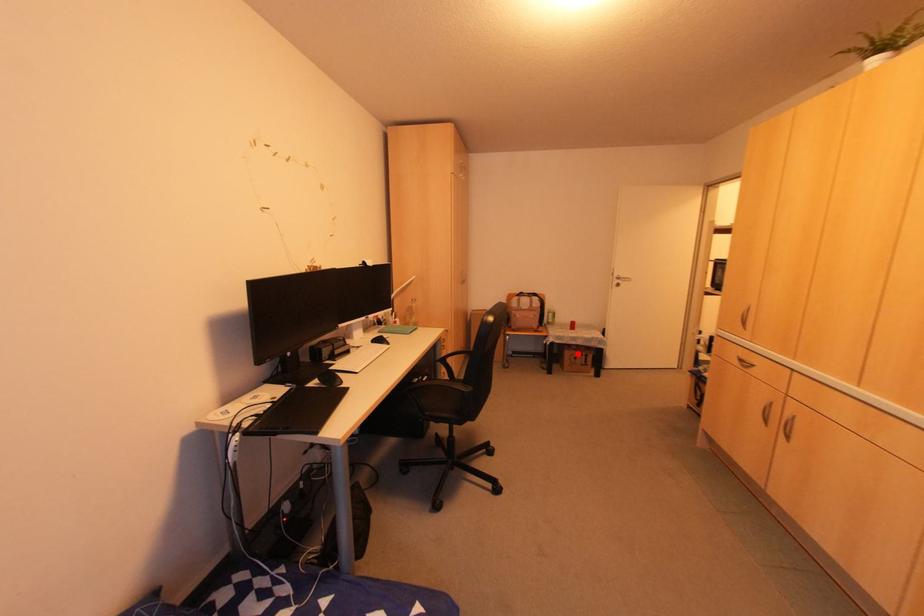
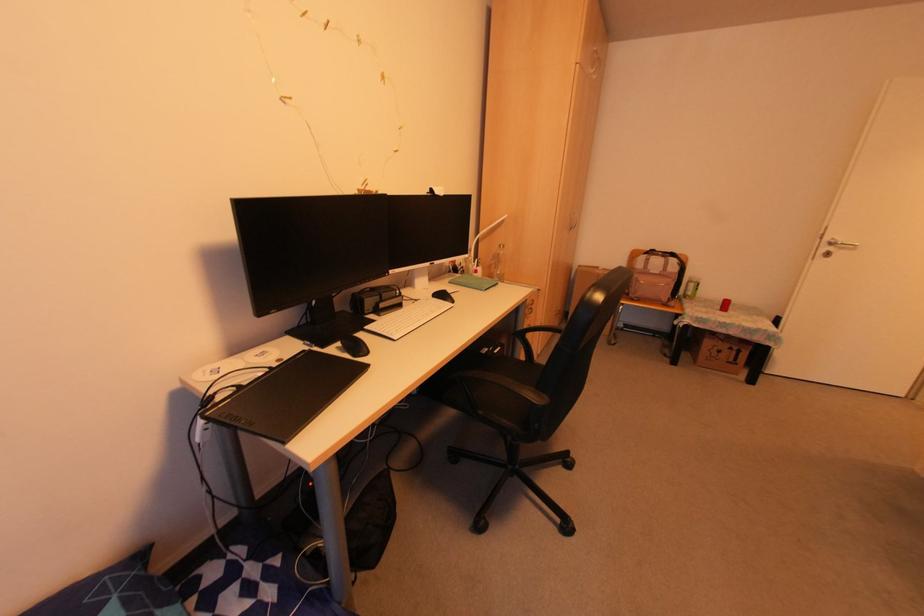
Where in the second image is the point corresponding to the highlighted location from the first image?

(725, 346)